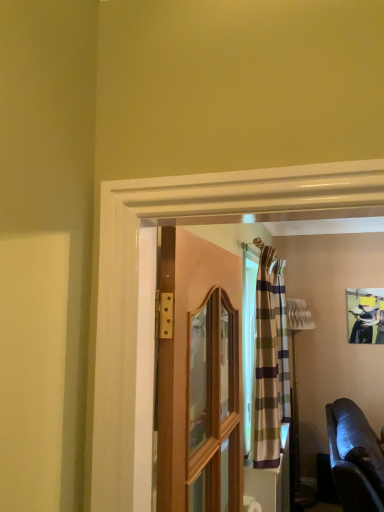
Question: Would you say wooden door at center is outside matte black picture frame at upper right?

Choices:
 (A) no
 (B) yes

Answer: (B)

Question: Is wooden door at center far away from matte black picture frame at upper right?

Choices:
 (A) no
 (B) yes

Answer: (B)

Question: Does wooden door at center appear on the right side of matte black picture frame at upper right?

Choices:
 (A) yes
 (B) no

Answer: (B)

Question: Does wooden door at center appear on the left side of matte black picture frame at upper right?

Choices:
 (A) no
 (B) yes

Answer: (B)

Question: Considering the relative sizes of wooden door at center and matte black picture frame at upper right in the image provided, is wooden door at center taller than matte black picture frame at upper right?

Choices:
 (A) no
 (B) yes

Answer: (B)

Question: From the image's perspective, is wooden door at center below matte black picture frame at upper right?

Choices:
 (A) no
 (B) yes

Answer: (A)

Question: Considering the relative sizes of wooden door at center and leather couch at lower right in the image provided, is wooden door at center shorter than leather couch at lower right?

Choices:
 (A) no
 (B) yes

Answer: (B)

Question: From the image's perspective, is wooden door at center beneath leather couch at lower right?

Choices:
 (A) no
 (B) yes

Answer: (A)

Question: Can you confirm if wooden door at center is bigger than leather couch at lower right?

Choices:
 (A) yes
 (B) no

Answer: (B)

Question: Is wooden door at center positioned behind leather couch at lower right?

Choices:
 (A) no
 (B) yes

Answer: (A)

Question: Is wooden door at center beside leather couch at lower right?

Choices:
 (A) yes
 (B) no

Answer: (B)

Question: Is wooden door at center to the left of leather couch at lower right from the viewer's perspective?

Choices:
 (A) no
 (B) yes

Answer: (B)

Question: Is leather couch at lower right not near wooden door at center?

Choices:
 (A) no
 (B) yes

Answer: (B)